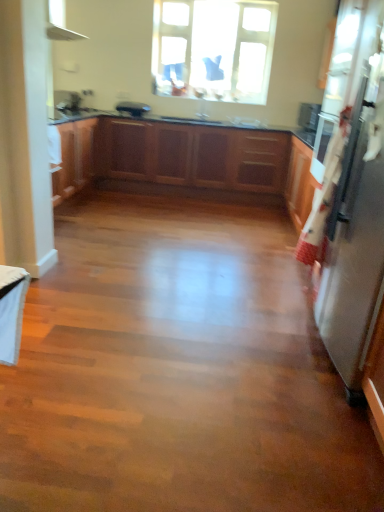
What do you see at coordinates (356, 220) in the screenshot? The height and width of the screenshot is (512, 384). I see `satin silver refrigerator at right, acting as the second appliance starting from the left` at bounding box center [356, 220].

The image size is (384, 512). What are the coordinates of `satin silver refrigerator at right, arranged as the first appliance when ordered from the bottom` in the screenshot? It's located at (356, 220).

Find the location of `white glossy sink at center`. white glossy sink at center is located at coordinates (247, 122).

Which of these two, wooden cabinets at center or transparent glass window at upper center, stands shorter?

Standing shorter between the two is wooden cabinets at center.

Is wooden cabinets at center positioned with its back to transparent glass window at upper center?

No, transparent glass window at upper center is not at the back of wooden cabinets at center.

Is transparent glass window at upper center surrounded by wooden cabinets at center?

Actually, transparent glass window at upper center is outside wooden cabinets at center.

Can you confirm if wooden cabinets at center is smaller than transparent glass window at upper center?

No.

Considering the positions of objects satin black toaster at center, the first appliance positioned from the top, and wooden cabinets at center in the image provided, who is more to the left, satin black toaster at center, the first appliance positioned from the top, or wooden cabinets at center?

From the viewer's perspective, satin black toaster at center, the first appliance positioned from the top, appears more on the left side.

Does satin black toaster at center, which is the 1th appliance in left-to-right order, have a greater width compared to wooden cabinets at center?

In fact, satin black toaster at center, which is the 1th appliance in left-to-right order, might be narrower than wooden cabinets at center.

Can you confirm if satin black toaster at center, placed as the first appliance when sorted from back to front, is shorter than wooden cabinets at center?

Yes.

From a real-world perspective, between satin black toaster at center, which is the 1th appliance in left-to-right order, and wooden cabinets at center, who is vertically lower?

wooden cabinets at center.

Is white glossy sink at center wider or thinner than wooden cabinets at center?

Considering their sizes, white glossy sink at center looks slimmer than wooden cabinets at center.

From the image's perspective, which one is positioned higher, white glossy sink at center or wooden cabinets at center?

white glossy sink at center.

From a real-world perspective, starting from the wooden cabinets at center, which appliance is the 1st one vertically above it? Please provide its 2D coordinates.

[(356, 220)]

Between wooden cabinets at center and satin silver refrigerator at right, which ranks as the second appliance in back-to-front order, which one appears on the left side from the viewer's perspective?

From the viewer's perspective, wooden cabinets at center appears more on the left side.

Considering the relative positions of wooden cabinets at center and satin silver refrigerator at right, which ranks as the second appliance in back-to-front order, in the image provided, is wooden cabinets at center behind satin silver refrigerator at right, which ranks as the second appliance in back-to-front order,?

Yes, wooden cabinets at center is further from the camera.

Is point (119, 109) more distant than point (335, 195)?

Yes, it is.

In terms of height, does satin black toaster at center, the first appliance positioned from the top, look taller or shorter compared to satin silver refrigerator at right, which ranks as the second appliance in back-to-front order?

Considering their sizes, satin black toaster at center, the first appliance positioned from the top, has less height than satin silver refrigerator at right, which ranks as the second appliance in back-to-front order.

Which object is more forward, satin black toaster at center, the 2th appliance when ordered from bottom to top, or satin silver refrigerator at right, arranged as the first appliance when ordered from the bottom?

satin silver refrigerator at right, arranged as the first appliance when ordered from the bottom, is more forward.

Does satin black toaster at center, positioned as the 2th appliance in front-to-back order, have a smaller size compared to satin silver refrigerator at right, which ranks as the second appliance in back-to-front order?

Yes, satin black toaster at center, positioned as the 2th appliance in front-to-back order, is smaller than satin silver refrigerator at right, which ranks as the second appliance in back-to-front order.

Is satin black toaster at center, which is the 1th appliance in left-to-right order, outside of white glossy sink at center?

Yes, satin black toaster at center, which is the 1th appliance in left-to-right order, is located beyond the bounds of white glossy sink at center.

Is satin black toaster at center, positioned as the 2th appliance in front-to-back order, wider than white glossy sink at center?

Yes, satin black toaster at center, positioned as the 2th appliance in front-to-back order, is wider than white glossy sink at center.

Can you confirm if satin black toaster at center, the 2th appliance from the right, is taller than white glossy sink at center?

Yes, satin black toaster at center, the 2th appliance from the right, is taller than white glossy sink at center.

Is satin black toaster at center, which is the 1th appliance in left-to-right order, facing towards white glossy sink at center?

No.

From the image's perspective, is satin black toaster at center, placed as the first appliance when sorted from back to front, beneath transparent glass window at upper center?

Yes, from the image's perspective, satin black toaster at center, placed as the first appliance when sorted from back to front, is beneath transparent glass window at upper center.

From a real-world perspective, who is located higher, satin black toaster at center, the 2th appliance from the right, or transparent glass window at upper center?

transparent glass window at upper center.

Can you confirm if satin black toaster at center, the first appliance positioned from the top, is wider than transparent glass window at upper center?

Indeed, satin black toaster at center, the first appliance positioned from the top, has a greater width compared to transparent glass window at upper center.

In the scene shown: Is satin black toaster at center, the 2th appliance when ordered from bottom to top, in contact with transparent glass window at upper center?

Answer: satin black toaster at center, the 2th appliance when ordered from bottom to top, and transparent glass window at upper center are clearly separated.

Locate an element on the screen. window above the wooden cabinets at center (from a real-world perspective) is located at coordinates (213, 49).

You are a GUI agent. You are given a task and a screenshot of the screen. Output one action in this format:
    pyautogui.click(x=<x>, y=<y>)
    Task: Click on the cabinetry to the right of satin black toaster at center, the first appliance positioned from the top
    This screenshot has height=512, width=384.
    Given the screenshot: What is the action you would take?
    click(186, 158)

Which object lies further to the anchor point white glossy sink at center, transparent glass window at upper center or satin silver refrigerator at right, marked as the first appliance in a front-to-back arrangement?

satin silver refrigerator at right, marked as the first appliance in a front-to-back arrangement.

Looking at the image, which one is located further to wooden cabinets at center, white glossy sink at center or transparent glass window at upper center?

transparent glass window at upper center is positioned further to the anchor wooden cabinets at center.

Based on their spatial positions, is transparent glass window at upper center or wooden cabinets at center closer to satin silver refrigerator at right, placed as the first appliance when sorted from right to left?

wooden cabinets at center is closer to satin silver refrigerator at right, placed as the first appliance when sorted from right to left.

When comparing their distances from wooden cabinets at center, does satin black toaster at center, placed as the first appliance when sorted from back to front, or satin silver refrigerator at right, which ranks as the second appliance in back-to-front order, seem further?

Among the two, satin silver refrigerator at right, which ranks as the second appliance in back-to-front order, is located further to wooden cabinets at center.

Based on their spatial positions, is white glossy sink at center or satin silver refrigerator at right, which appears as the 2th appliance when viewed from the top, further from wooden cabinets at center?

The object further to wooden cabinets at center is satin silver refrigerator at right, which appears as the 2th appliance when viewed from the top.

Looking at the image, which one is located further to white glossy sink at center, satin silver refrigerator at right, marked as the first appliance in a front-to-back arrangement, or wooden cabinets at center?

Among the two, satin silver refrigerator at right, marked as the first appliance in a front-to-back arrangement, is located further to white glossy sink at center.

Which object lies further to the anchor point satin black toaster at center, which is the 1th appliance in left-to-right order, satin silver refrigerator at right, marked as the first appliance in a front-to-back arrangement, or wooden cabinets at center?

Among the two, satin silver refrigerator at right, marked as the first appliance in a front-to-back arrangement, is located further to satin black toaster at center, which is the 1th appliance in left-to-right order.

When comparing their distances from satin black toaster at center, positioned as the 2th appliance in front-to-back order, does transparent glass window at upper center or white glossy sink at center seem further?

Among the two, white glossy sink at center is located further to satin black toaster at center, positioned as the 2th appliance in front-to-back order.

Find the location of a particular element. Image resolution: width=384 pixels, height=512 pixels. cabinetry located between satin silver refrigerator at right, placed as the first appliance when sorted from right to left, and white glossy sink at center in the depth direction is located at coordinates (186, 158).

In order to click on sink between satin silver refrigerator at right, acting as the second appliance starting from the left, and satin black toaster at center, which is the 1th appliance in left-to-right order, from front to back in this screenshot , I will do [247, 122].

This screenshot has height=512, width=384. Identify the location of sink between transparent glass window at upper center and wooden cabinets at center in the up-down direction. (247, 122).

Where is `window situated between satin black toaster at center, the 2th appliance from the right, and white glossy sink at center from left to right`? This screenshot has height=512, width=384. window situated between satin black toaster at center, the 2th appliance from the right, and white glossy sink at center from left to right is located at coordinates (213, 49).